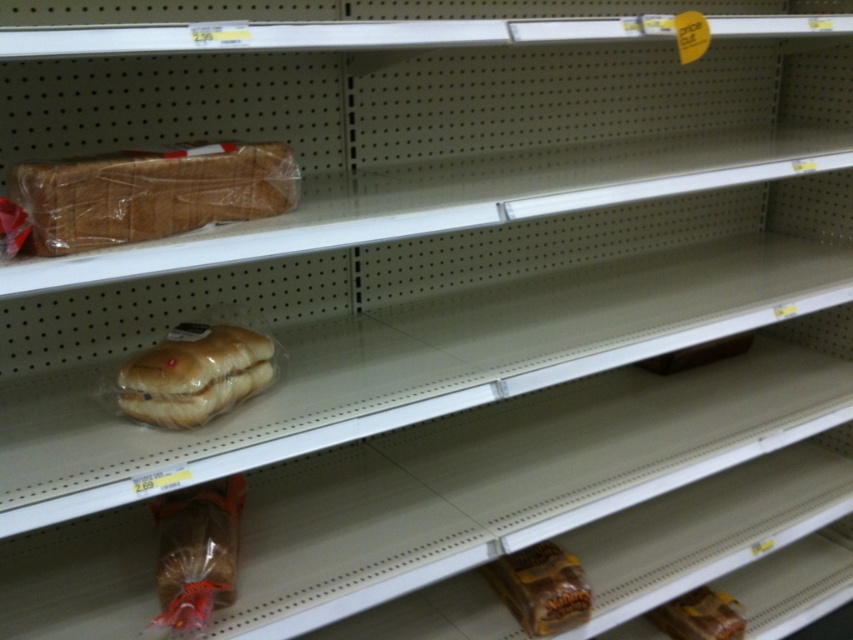
You are a grocery store employee who needs to restock the bread aisle. You have a new loaf of bread that needs to be placed to the right of the translucent plastic loaf of bread at upper left. Where should you place it in relation to the golden matte bread at center?

You should place the new loaf of bread to the right of the translucent plastic loaf of bread at upper left, which would position it to the left of the golden matte bread at center since the translucent plastic loaf of bread at upper left is to the left of golden matte bread at center.

You are a grocery store employee restocking the bread aisle. You need to place a new loaf of bread between the translucent plastic loaf of bread at upper left and the brown matte bread at lower right. Where should you position it to maintain the existing arrangement?

Place the new loaf of bread between the translucent plastic loaf of bread at upper left and the brown matte bread at lower right, ensuring it is positioned to the right of the translucent plastic loaf of bread at upper left and to the left of the brown matte bread at lower right to maintain the existing arrangement.

You are a customer trying to reach an item on the grocery store shelf. You notice two points marked on the shelf. Which point is closer to you, point (215, 177) or point (715, 602)?

Point (215, 177) is closer to the camera than point (715, 602), so the customer should reach for the item at point (215, 177) since it is closer.